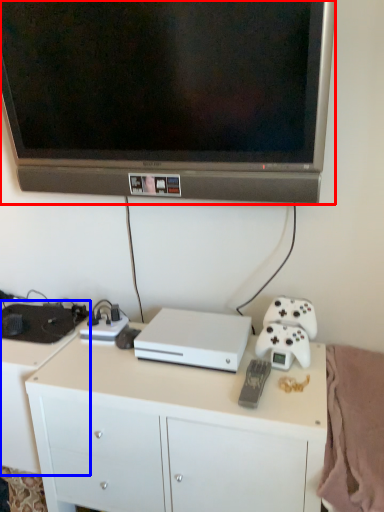
Question: Which point is closer to the camera, television (highlighted by a red box) or desk (highlighted by a blue box)?

Choices:
 (A) television
 (B) desk

Answer: (A)